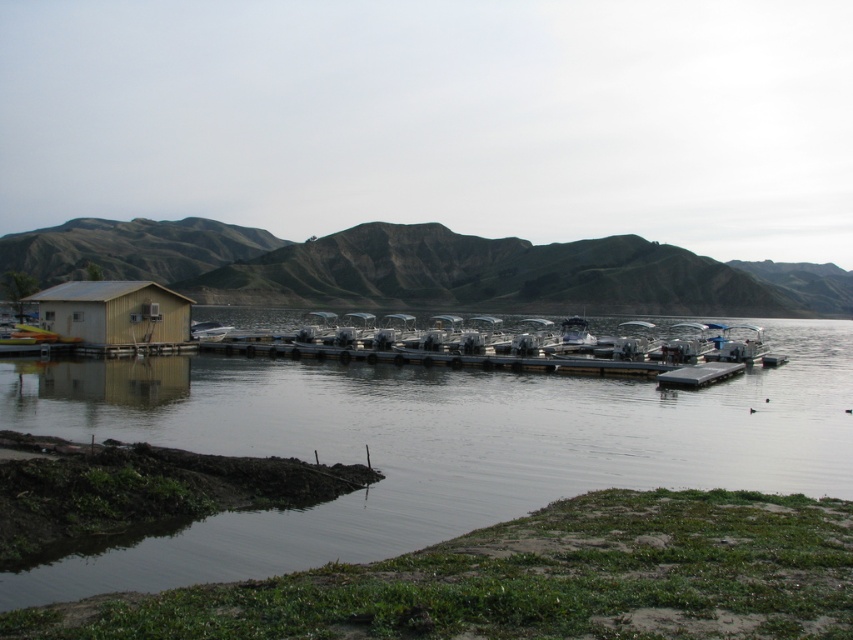
Is green textured mountain at upper center to the right of light brown wooden hut at left from the viewer's perspective?

Indeed, green textured mountain at upper center is positioned on the right side of light brown wooden hut at left.

Who is higher up, green textured mountain at upper center or light brown wooden hut at left?

green textured mountain at upper center

Between point (428, 259) and point (67, 300), which one is positioned in front?

Positioned in front is point (67, 300).

Where is `green textured mountain at upper center`? green textured mountain at upper center is located at coordinates (422, 268).

Does clear water at lower left come in front of light brown wooden hut at left?

Yes, clear water at lower left is closer to the viewer.

Is point (364, 456) farther from viewer compared to point (189, 317)?

No, it is not.

You are a GUI agent. You are given a task and a screenshot of the screen. Output one action in this format:
    pyautogui.click(x=<x>, y=<y>)
    Task: Click on the clear water at lower left
    Image resolution: width=853 pixels, height=640 pixels.
    Given the screenshot: What is the action you would take?
    [x=425, y=445]

Does clear water at lower left have a greater width compared to green textured mountain at upper center?

In fact, clear water at lower left might be narrower than green textured mountain at upper center.

Does clear water at lower left appear on the left side of green textured mountain at upper center?

Correct, you'll find clear water at lower left to the left of green textured mountain at upper center.

Measure the distance between point (453, 472) and camera.

Point (453, 472) and camera are 47.02 feet apart from each other.

You are a GUI agent. You are given a task and a screenshot of the screen. Output one action in this format:
    pyautogui.click(x=<x>, y=<y>)
    Task: Click on the clear water at lower left
    
    Given the screenshot: What is the action you would take?
    [x=425, y=445]